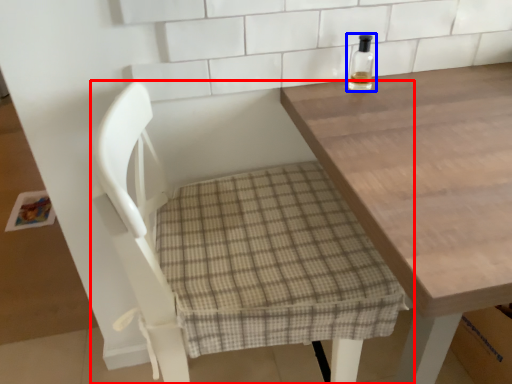
Question: Which of the following is the farthest to the observer, chair (highlighted by a red box) or bottle (highlighted by a blue box)?

Choices:
 (A) chair
 (B) bottle

Answer: (B)